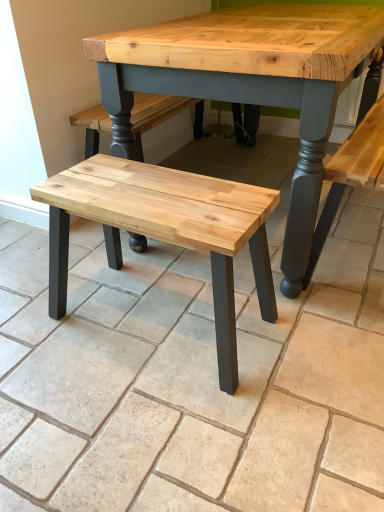
Locate an element on the screen. The height and width of the screenshot is (512, 384). free space that is to the left of natural wood stool at center is located at coordinates (44, 322).